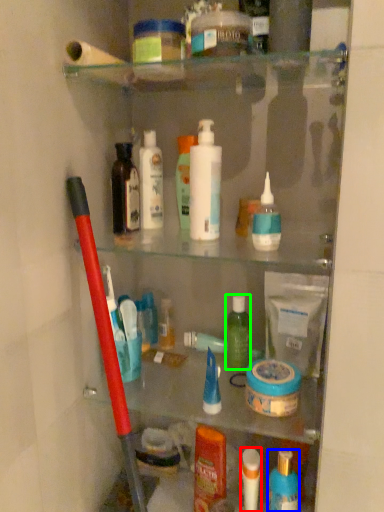
Question: Which object is positioned farthest from toiletry (highlighted by a red box)? Select from toiletry (highlighted by a blue box) and toiletry (highlighted by a green box).

Choices:
 (A) toiletry
 (B) toiletry

Answer: (B)